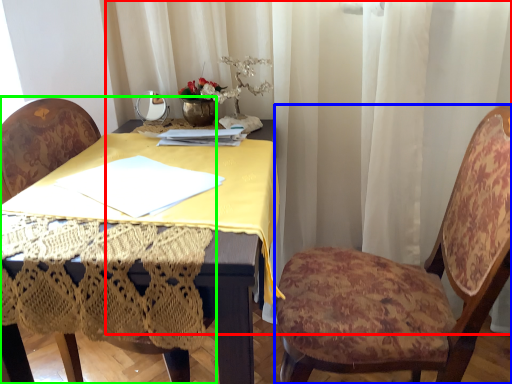
Question: Which object is the closest to the curtain (highlighted by a red box)? Choose among these: chair (highlighted by a blue box) or chair (highlighted by a green box).

Choices:
 (A) chair
 (B) chair

Answer: (A)